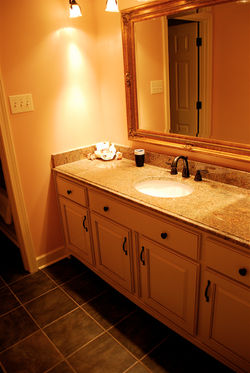
I want to click on sink, so click(x=163, y=183).